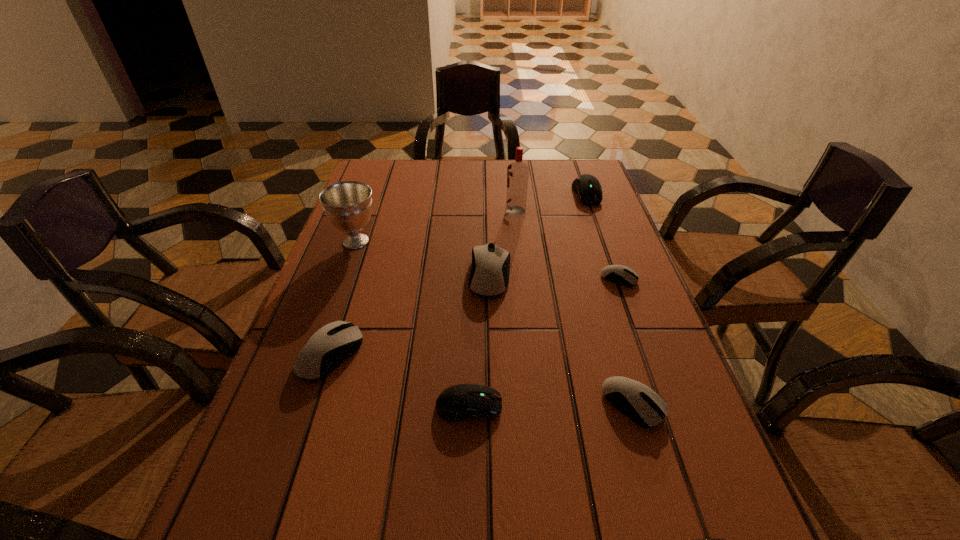
Point out which computer equipment is positioned as the second nearest to the vodka. Please provide its 2D coordinates. Your answer should be formatted as a tuple, i.e. [(x, y)], where the tuple contains the x and y coordinates of a point satisfying the conditions above.

[(489, 276)]

Where is `computer equipment that is the fourth closest to the leftmost white mouse`? The image size is (960, 540). computer equipment that is the fourth closest to the leftmost white mouse is located at coordinates (623, 275).

Locate an element on the screen. This screenshot has width=960, height=540. the fourth closest white mouse to the red vodka is located at coordinates (643, 405).

You are a GUI agent. You are given a task and a screenshot of the screen. Output one action in this format:
    pyautogui.click(x=<x>, y=<y>)
    Task: Click on the white mouse that is the third closest one to the seventh shortest object
    The width and height of the screenshot is (960, 540).
    Given the screenshot: What is the action you would take?
    pyautogui.click(x=643, y=405)

Choose which dark computer equipment is the second nearest neighbor to the second smallest dark computer equipment. Please provide its 2D coordinates. Your answer should be formatted as a tuple, i.e. [(x, y)], where the tuple contains the x and y coordinates of a point satisfying the conditions above.

[(587, 187)]

Find the location of a particular element. dark computer equipment identified as the closest to the leftmost computer equipment is located at coordinates (459, 402).

Where is `vacant position in the image that satisfies the following two spatial constraints: 1. on the front side of the second white mouse from left to right; 2. on the left side of the second smallest white mouse`? The image size is (960, 540). vacant position in the image that satisfies the following two spatial constraints: 1. on the front side of the second white mouse from left to right; 2. on the left side of the second smallest white mouse is located at coordinates (493, 404).

Image resolution: width=960 pixels, height=540 pixels. In order to click on free space that satisfies the following two spatial constraints: 1. on the front label of the tallest object; 2. on the left side of the second smallest white mouse in this screenshot , I will do `click(538, 404)`.

At what (x,y) coordinates should I click in order to perform the action: click on vacant space that satisfies the following two spatial constraints: 1. on the back side of the leftmost computer equipment; 2. on the right side of the tallest computer equipment. Please return your answer as a coordinate pair (x, y). Image resolution: width=960 pixels, height=540 pixels. Looking at the image, I should click on (356, 275).

Find the location of a particular element. The width and height of the screenshot is (960, 540). vacant space that satisfies the following two spatial constraints: 1. on the button of the farthest dark computer equipment; 2. on the front label of the tallest object is located at coordinates (593, 211).